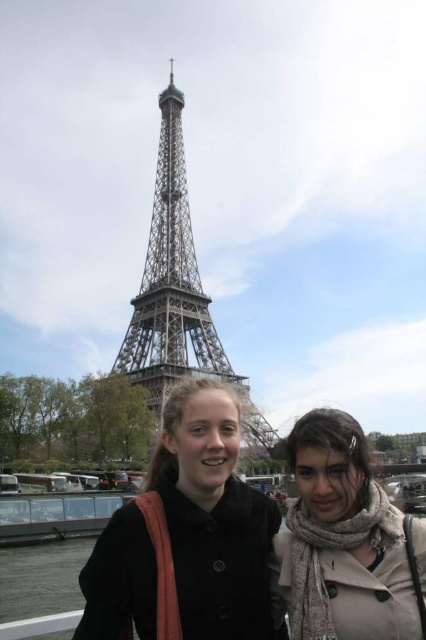
Question: Can you confirm if beige textured scarf at lower right is wider than metallic gray tower at center?

Choices:
 (A) no
 (B) yes

Answer: (A)

Question: Is black matte coat at center thinner than metallic gray tower at center?

Choices:
 (A) no
 (B) yes

Answer: (A)

Question: Which point is closer to the camera taking this photo?

Choices:
 (A) (224, 564)
 (B) (305, 435)

Answer: (A)

Question: Which point is farther to the camera?

Choices:
 (A) metallic gray tower at center
 (B) beige textured scarf at lower right
 (C) black matte coat at center

Answer: (A)

Question: Estimate the real-world distances between objects in this image. Which object is farther from the metallic gray tower at center?

Choices:
 (A) beige textured scarf at lower right
 (B) black matte coat at center

Answer: (A)

Question: Can you confirm if beige textured scarf at lower right is bigger than metallic gray tower at center?

Choices:
 (A) yes
 (B) no

Answer: (B)